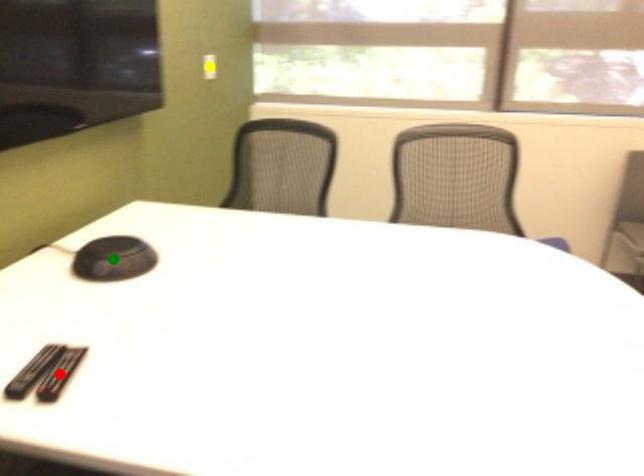
Looking at this image, order these from nearest to farthest:
A) yellow point
B) green point
C) red point

yellow point
green point
red point